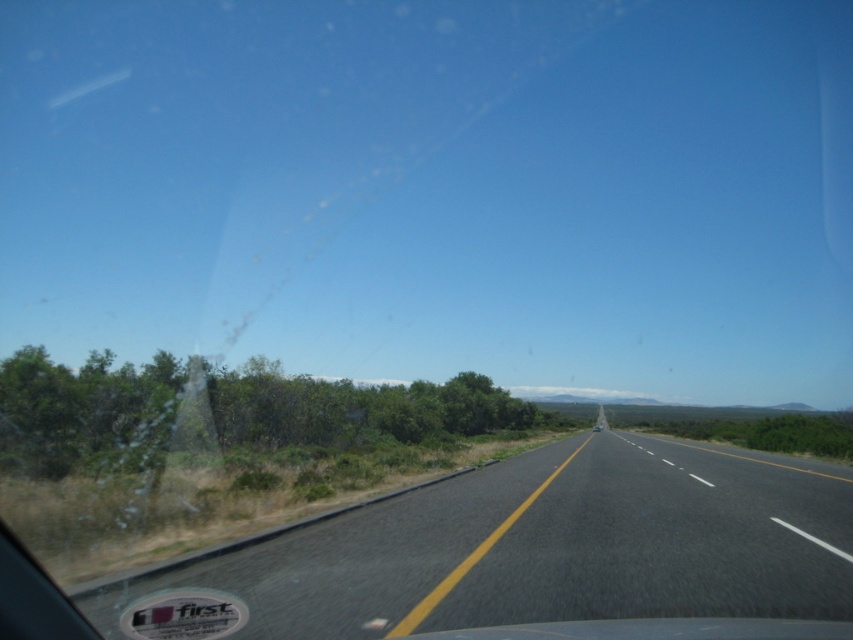
You are a driver trying to navigate a narrow road. You see the black asphalt road at center and the green leafy shrub at left in your view. Which object takes up more space in the scene?

The green leafy shrub at left occupies more space in the scene than the black asphalt road at center according to the description.

Looking at this image, you are driving a car that is 2 meters wide. You need to stay entirely on the black asphalt road at center while passing a green leafy shrub at left. Is there enough space on the road to do so?

The black asphalt road at center is thinner than green leafy shrub at left, but since the shrub is on the side and the road width must accommodate the car, the road might be narrower than needed. However, without exact measurements, it is uncertain. Please check the road width before proceeding.

You are driving a car and want to know if the black asphalt road at center is taller than the green leafy shrub at left. Based on the scene, what can you conclude?

The black asphalt road at center has a lesser height compared to green leafy shrub at left, so the shrub is taller than the road.